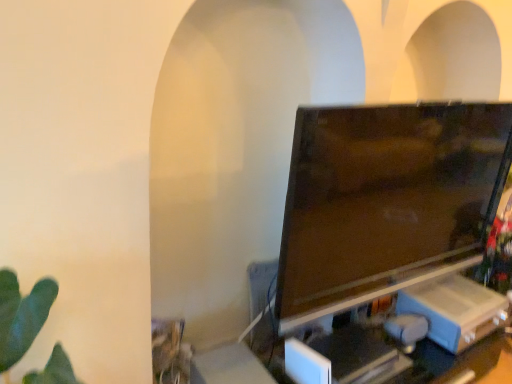
Question: Would you say black plastic computer desk at lower right is to the left or to the right of matte black tv at center in the picture?

Choices:
 (A) right
 (B) left

Answer: (A)

Question: Is black plastic computer desk at lower right bigger or smaller than matte black tv at center?

Choices:
 (A) big
 (B) small

Answer: (A)

Question: Is point (231, 375) closer or farther from the camera than point (336, 185)?

Choices:
 (A) closer
 (B) farther

Answer: (B)

Question: Choose the correct answer: Is matte black tv at center inside black plastic computer desk at lower right or outside it?

Choices:
 (A) outside
 (B) inside

Answer: (A)

Question: From a real-world perspective, is matte black tv at center above or below black plastic computer desk at lower right?

Choices:
 (A) above
 (B) below

Answer: (A)

Question: Looking at their shapes, would you say matte black tv at center is wider or thinner than black plastic computer desk at lower right?

Choices:
 (A) thin
 (B) wide

Answer: (A)

Question: Is point (325, 230) positioned closer to the camera than point (226, 364)?

Choices:
 (A) farther
 (B) closer

Answer: (B)